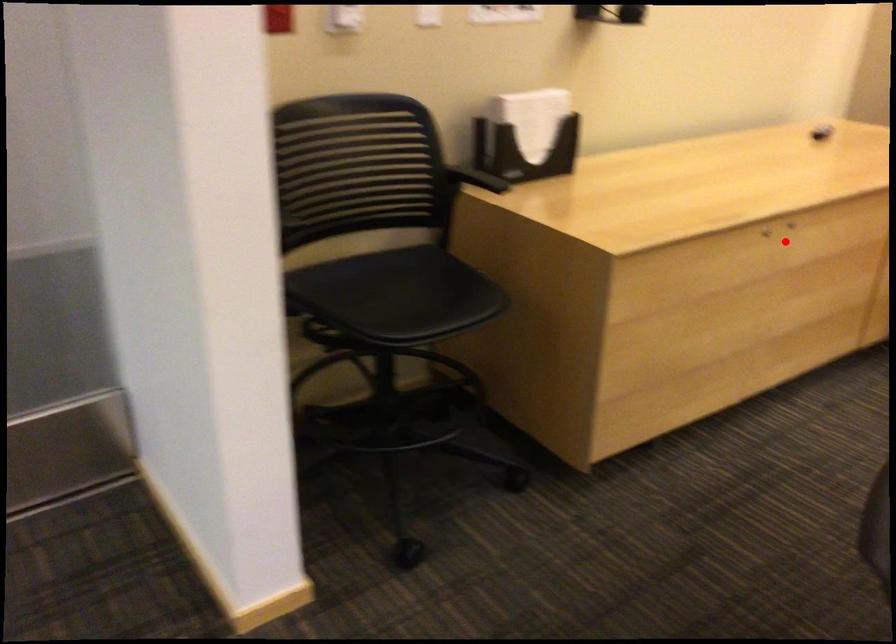
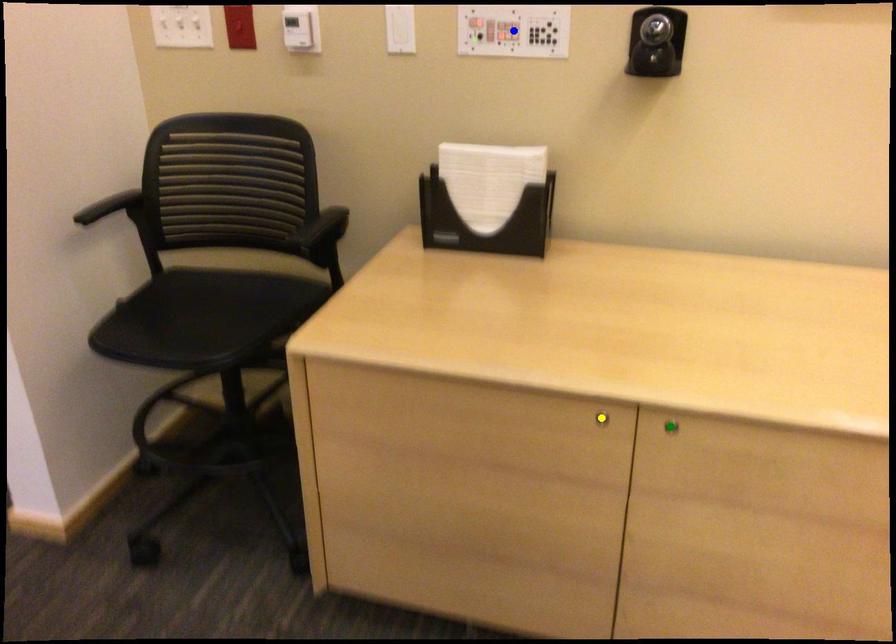
Question: I am providing you with two images of the same scene from different viewpoints. A red point is marked on the first image. You are given multiple points on the second image. Which point in image 2 represents the same 3d spot as the red point in image 1?

Choices:
 (A) blue point
 (B) green point
 (C) yellow point

Answer: (B)